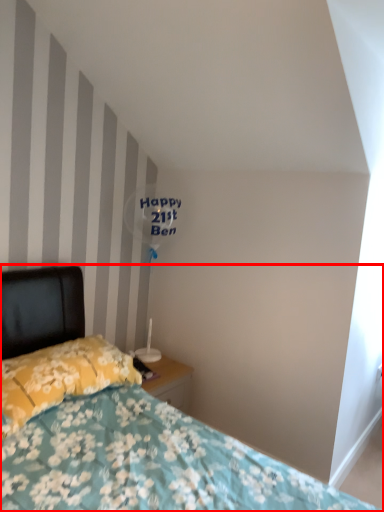
Question: Observing the image, what is the correct spatial positioning of bed (annotated by the red box) in reference to pillow?

Choices:
 (A) right
 (B) left

Answer: (A)